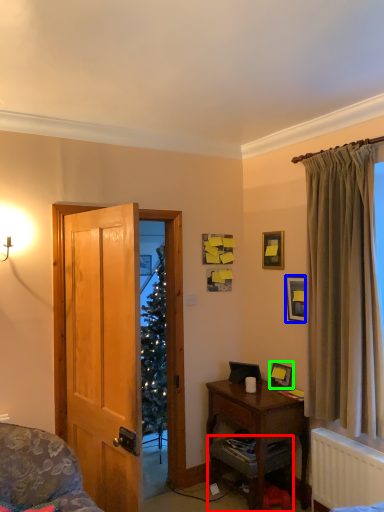
Question: Based on their relative distances, which object is farther from cabinetry (highlighted by a red box)? Choose from picture frame (highlighted by a blue box) and picture frame (highlighted by a green box).

Choices:
 (A) picture frame
 (B) picture frame

Answer: (A)